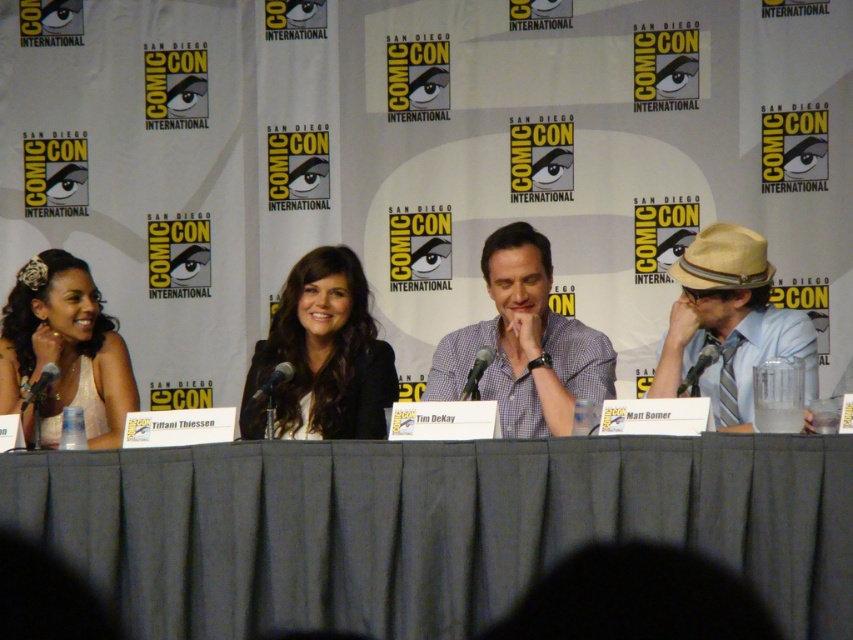
Looking at this image, you are organizing a panel at Comic Con and need to ensure that all items on the table are visible to the audience. Given that the black matte blazer at center and the tan straw hat at right are placed on the table, which item takes up more space on the table?

The tan straw hat at right takes up more space on the table because the black matte blazer at center occupies less space than the tan straw hat at right.

You are organizing a panel discussion and need to ensure there is enough space for all participants. The black matte blazer at center and the white satin dress at left are two items on the table. Which item takes up more space on the table?

The white satin dress at left occupies more space than the black matte blazer at center.

You are sitting at the back of the room and want to point to the point at (111, 534) without moving your head. Can you also see the point at (553, 337) in your line of sight?

Since point (111, 534) is in front of point (553, 337), if you are looking at the first point, the second point would be behind it in your line of sight.